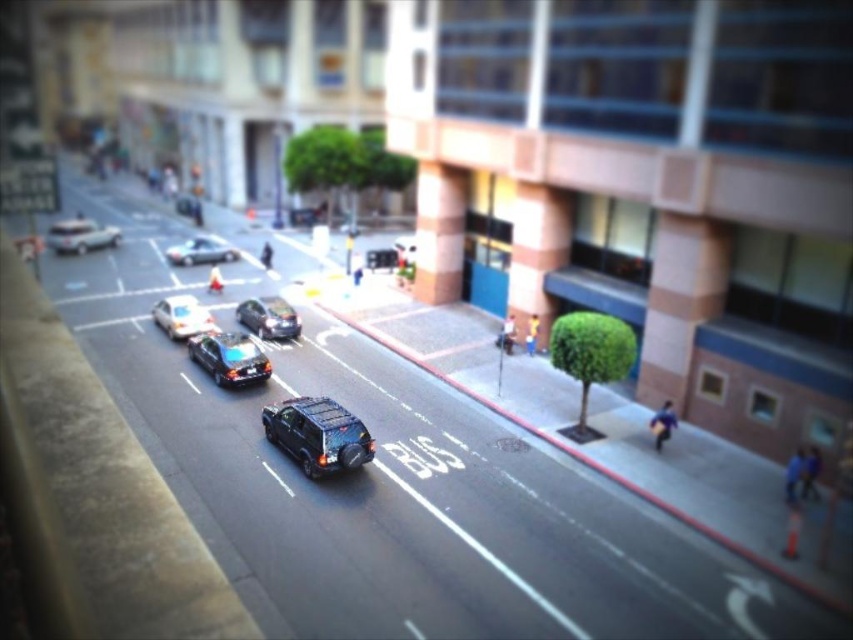
You are a pedestrian standing at the edge of the road and see two cars in the center of the road. Which car is closer to the right side of the road? The shiny black sedan at center or the shiny silver sedan at center?

The shiny black sedan at center is closer to the right side of the road because it is positioned to the right of the shiny silver sedan at center.

You are a pedestrian standing at the edge of the road and see the shiny black car at center and the shiny silver taxi at center. Which vehicle is positioned more to the right side of the road?

The shiny black car at center is positioned more to the right side of the road than the shiny silver taxi at center.

You are a pedestrian standing at the edge of the road. You see a shiny black car at center and a shiny silver taxi at center. Which vehicle is closer to you?

The shiny black car at center is closer to you because it is located below the shiny silver taxi at center, indicating it is positioned lower in the visual plane and thus nearer in the perspective.